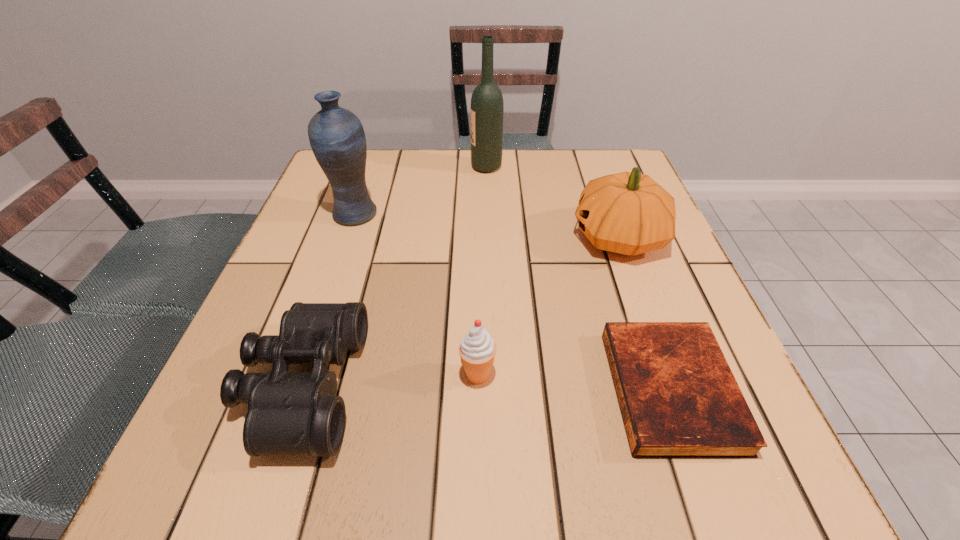
This screenshot has height=540, width=960. In order to click on Bible located in the near edge section of the desktop in this screenshot , I will do `click(678, 397)`.

The height and width of the screenshot is (540, 960). I want to click on vase that is at the left edge, so click(x=336, y=135).

What are the coordinates of `binoculars that is at the left edge` in the screenshot? It's located at pos(288,413).

This screenshot has height=540, width=960. I want to click on gourd positioned at the right edge, so click(x=628, y=213).

Where is `Bible situated at the right edge`? Bible situated at the right edge is located at coordinates (678, 397).

What are the coordinates of `object that is at the near left corner` in the screenshot? It's located at (288, 413).

Identify the location of object at the near right corner. The height and width of the screenshot is (540, 960). (678, 397).

Identify the location of free location at the far edge of the desktop. This screenshot has height=540, width=960. (472, 192).

In the image, there is a desktop. In order to click on vacant space at the near edge in this screenshot , I will do `click(653, 498)`.

This screenshot has width=960, height=540. What are the coordinates of `vacant space at the left edge of the desktop` in the screenshot? It's located at (347, 256).